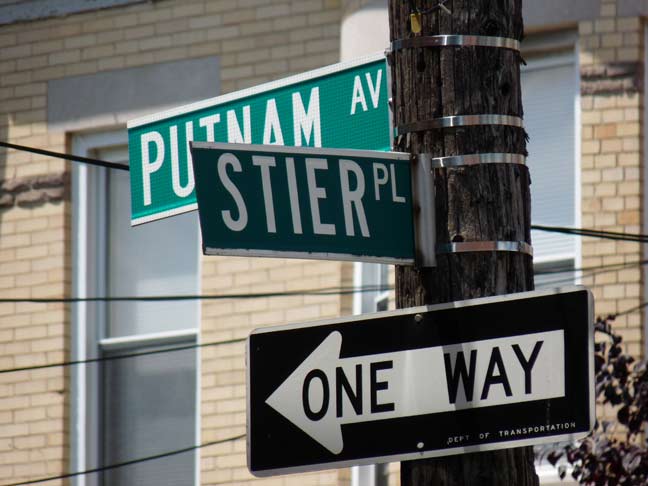
This screenshot has width=648, height=486. I want to click on brick wall, so click(x=27, y=268), click(x=259, y=37), click(x=621, y=179).